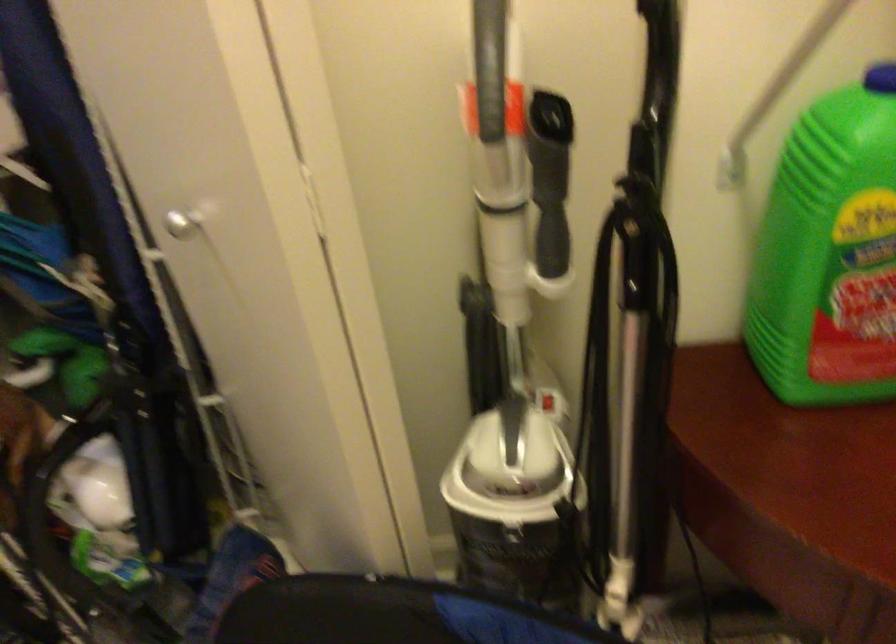
Where would you grip the vacuum cleaner handle? Please return your answer as a coordinate pair (x, y).

(497, 330)